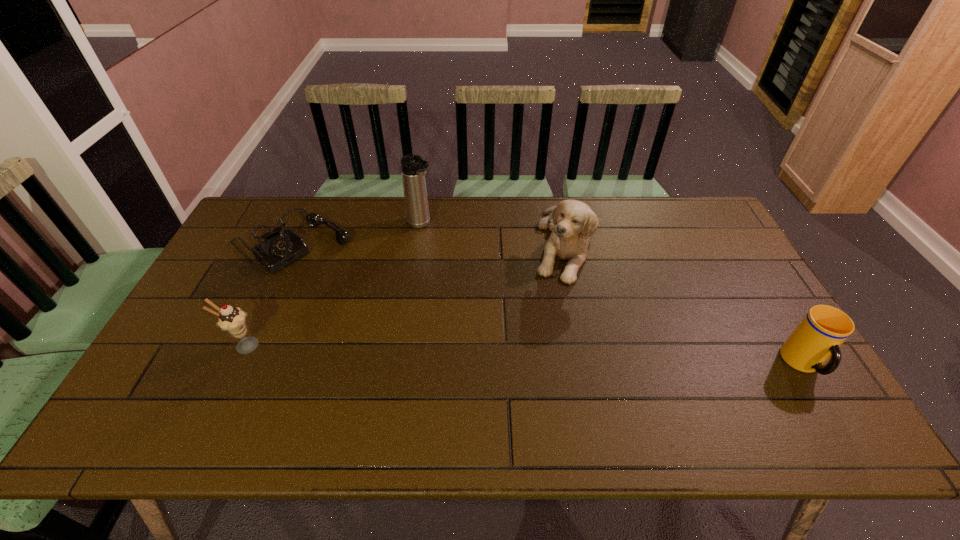
The image size is (960, 540). Identify the location of vacant space located on the front-facing side of the second object from right to left. (566, 340).

Where is `vacant space located on the handle side of the tallest object`? vacant space located on the handle side of the tallest object is located at coordinates (505, 298).

I want to click on free location located 0.340m on the handle side of the tallest object, so click(x=495, y=290).

Locate an element on the screen. The width and height of the screenshot is (960, 540). free space located on the handle side of the tallest object is located at coordinates (452, 253).

Identify the location of vacant space located 0.090m on the dial of the telephone. (348, 276).

Find the location of a particular element. The height and width of the screenshot is (540, 960). vacant space located on the dial of the telephone is located at coordinates pos(356,282).

Where is `free location located 0.120m on the dial of the telephone`? free location located 0.120m on the dial of the telephone is located at coordinates (354, 280).

Find the location of a particular element. This screenshot has width=960, height=540. puppy located in the far edge section of the desktop is located at coordinates (572, 223).

The width and height of the screenshot is (960, 540). Find the location of `thermos bottle that is positioned at the far edge`. thermos bottle that is positioned at the far edge is located at coordinates (413, 168).

At what (x,y) coordinates should I click in order to perform the action: click on telephone that is at the far edge. Please return your answer as a coordinate pair (x, y). Image resolution: width=960 pixels, height=540 pixels. Looking at the image, I should click on (279, 249).